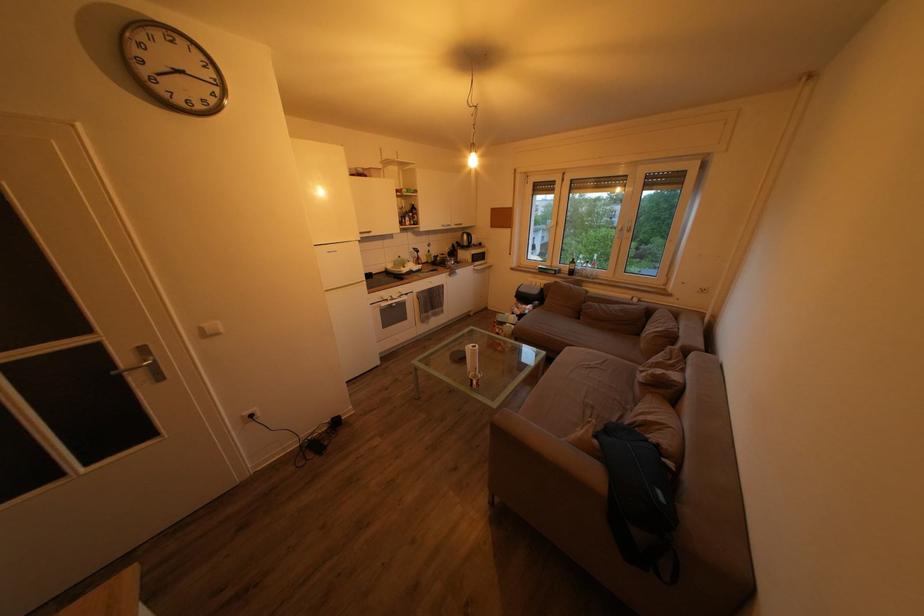
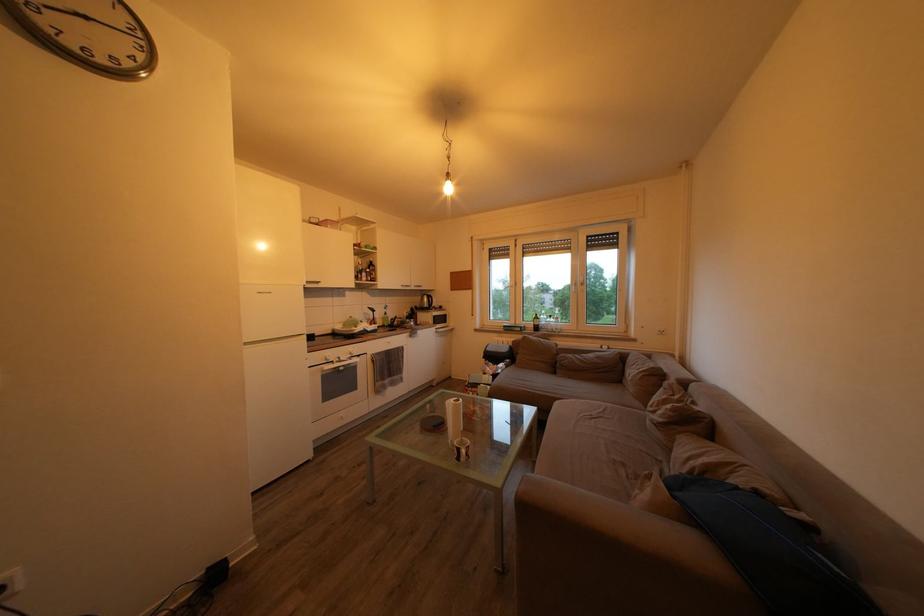
Locate, in the second image, the point that corresponds to (x=488, y=264) in the first image.

(448, 326)